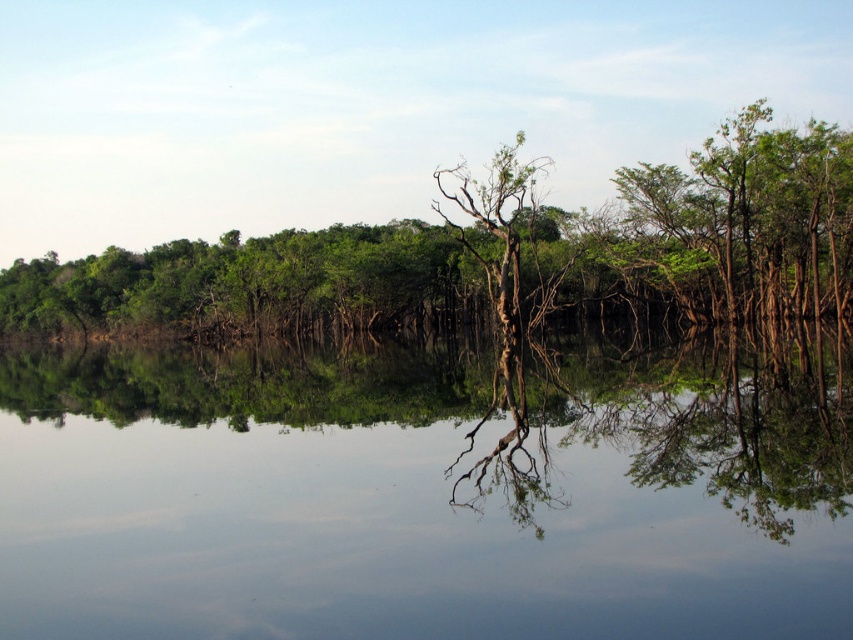
You are standing at the edge of the water in the serene landscape. You notice two points marked in the scene. Which point, point [9,452] or point [442,291], is closer to you?

Point [9,452] is closer to the camera than point [442,291].

You are standing on the bank of the lake and see the transparent water at center and the green matte tree at center. Which object is positioned to the right when looking towards the lake?

The transparent water at center is positioned to the right of the green matte tree at center.

You are standing at the edge of the water and want to place a small floating decoration exactly at the center of the transparent water at center. According to the coordinates provided, where should you place it?

The transparent water at center should be placed at coordinates point [404,500].